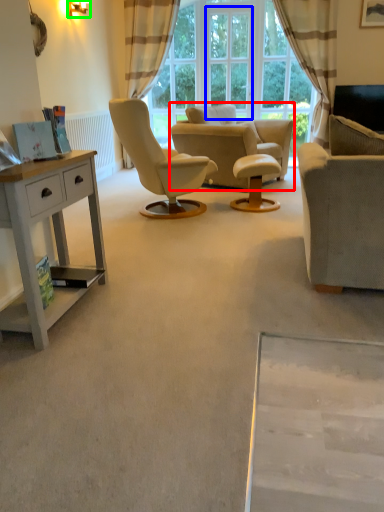
Question: Which is farther away from chair (highlighted by a red box)? window screen (highlighted by a blue box) or lamp (highlighted by a green box)?

Choices:
 (A) window screen
 (B) lamp

Answer: (B)